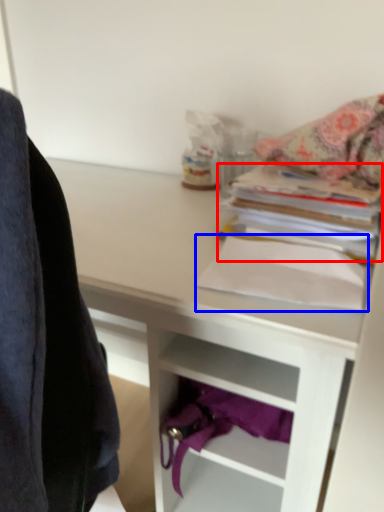
Question: Which object appears farthest to the camera in this image, paperback book (highlighted by a red box) or paperback book (highlighted by a blue box)?

Choices:
 (A) paperback book
 (B) paperback book

Answer: (A)